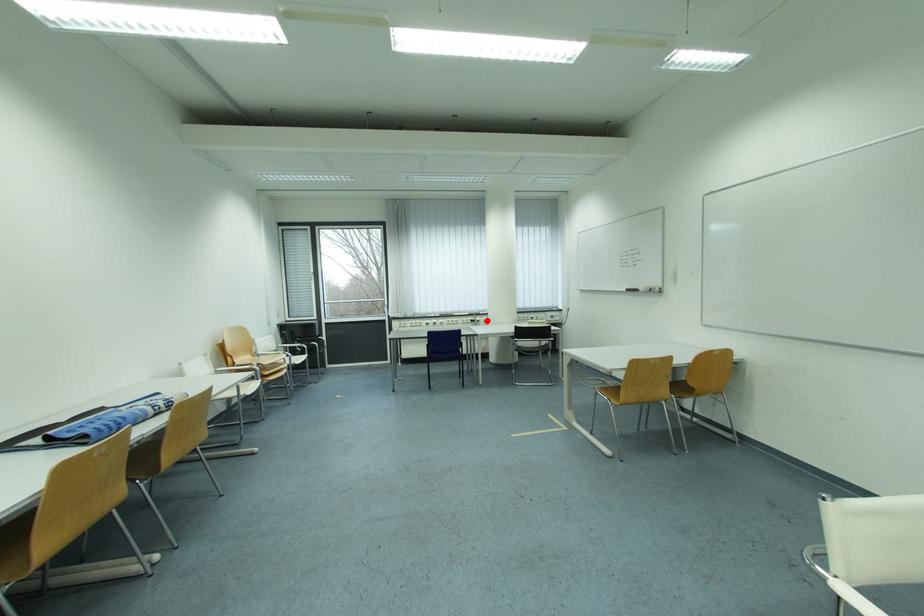
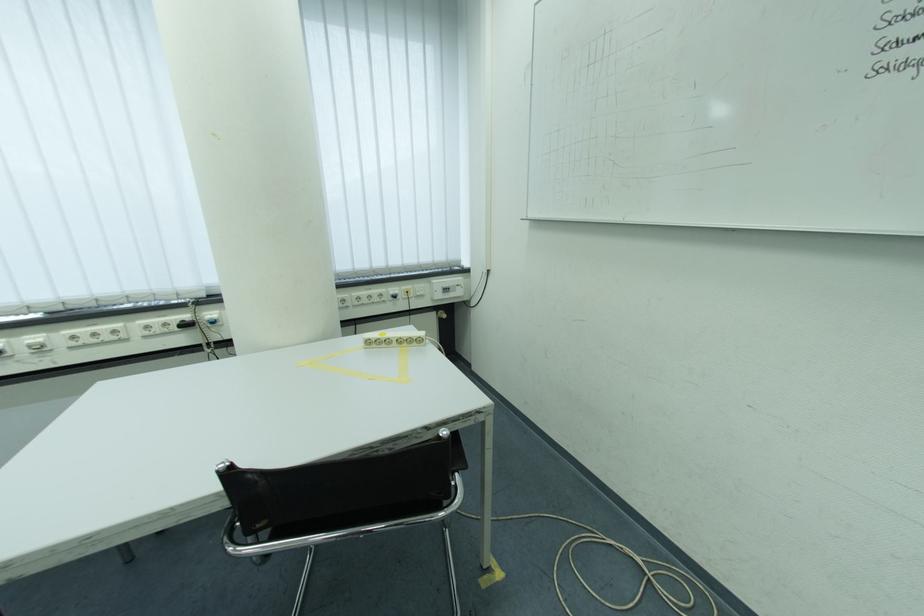
In the second image, find the point that corresponds to the highlighted location in the first image.

(217, 315)